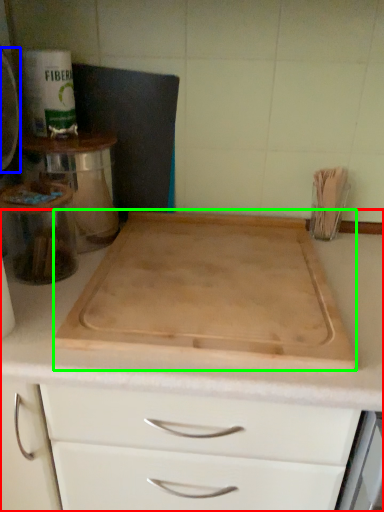
Question: Which object is positioned closest to countertop (highlighted by a red box)? Select from appliance (highlighted by a blue box) and cutting board (highlighted by a green box).

Choices:
 (A) appliance
 (B) cutting board

Answer: (B)